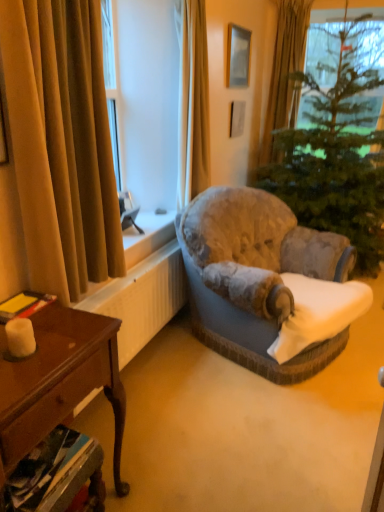
Question: Could you tell me if velvet beige curtain at upper center, the second curtain viewed from the back, is turned towards gold velvet curtain at upper right, which is the third curtain from left to right?

Choices:
 (A) no
 (B) yes

Answer: (A)

Question: Can you confirm if velvet beige curtain at upper center, marked as the 2th curtain in a front-to-back arrangement, is bigger than gold velvet curtain at upper right, which is the third curtain from left to right?

Choices:
 (A) no
 (B) yes

Answer: (A)

Question: Would you say velvet beige curtain at upper center, marked as the 2th curtain in a front-to-back arrangement, is outside gold velvet curtain at upper right, which is the third curtain from front to back?

Choices:
 (A) yes
 (B) no

Answer: (A)

Question: Is velvet beige curtain at upper center, the second curtain viewed from the left, positioned with its back to gold velvet curtain at upper right, which is the 1th curtain from right to left?

Choices:
 (A) yes
 (B) no

Answer: (B)

Question: Can you confirm if velvet beige curtain at upper center, the second curtain viewed from the back, is wider than gold velvet curtain at upper right, which is the third curtain from left to right?

Choices:
 (A) yes
 (B) no

Answer: (B)

Question: Is velvet beige curtain at upper center, the second curtain viewed from the left, shorter than gold velvet curtain at upper right, which ranks as the first curtain in back-to-front order?

Choices:
 (A) yes
 (B) no

Answer: (A)

Question: From the image's perspective, is wooden desk at lower left on top of velvet beige curtain at upper center, marked as the 2th curtain in a front-to-back arrangement?

Choices:
 (A) yes
 (B) no

Answer: (B)

Question: Does wooden desk at lower left contain velvet beige curtain at upper center, the second curtain viewed from the left?

Choices:
 (A) no
 (B) yes

Answer: (A)

Question: Is wooden desk at lower left facing towards velvet beige curtain at upper center, the second curtain viewed from the back?

Choices:
 (A) yes
 (B) no

Answer: (B)

Question: Is wooden desk at lower left thinner than velvet beige curtain at upper center, the second curtain when ordered from right to left?

Choices:
 (A) yes
 (B) no

Answer: (B)

Question: From a real-world perspective, is wooden desk at lower left positioned under velvet beige curtain at upper center, the second curtain viewed from the left, based on gravity?

Choices:
 (A) no
 (B) yes

Answer: (B)

Question: Can you confirm if wooden desk at lower left is positioned to the right of velvet beige curtain at upper center, marked as the 2th curtain in a front-to-back arrangement?

Choices:
 (A) yes
 (B) no

Answer: (B)

Question: Could you tell me if green textured christmas tree at center is turned towards matte silver picture frame at upper center?

Choices:
 (A) no
 (B) yes

Answer: (A)